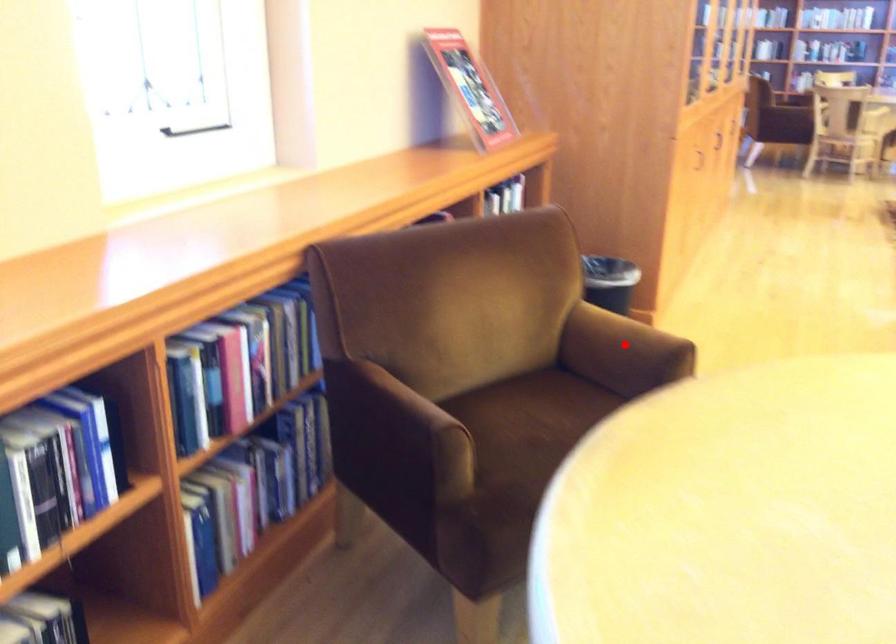
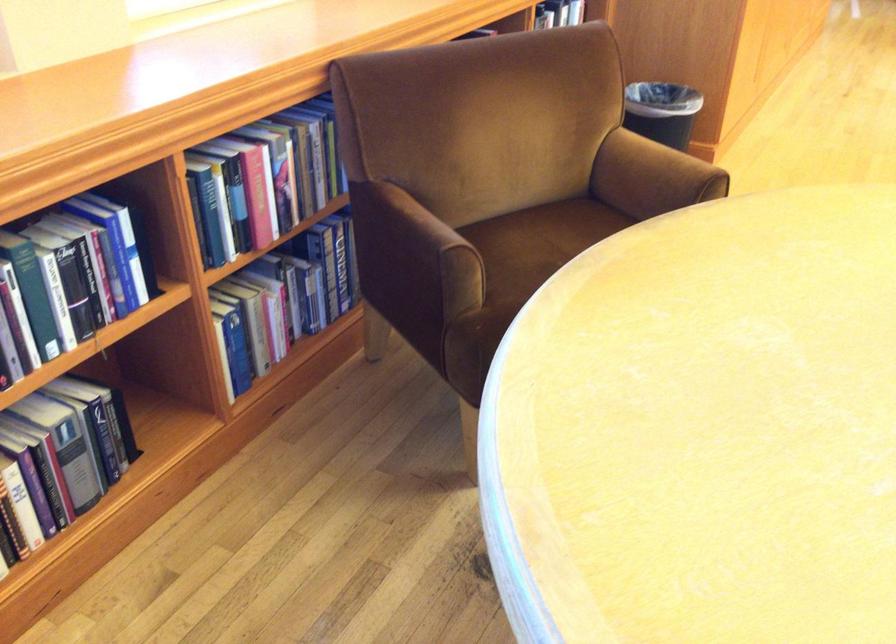
The point at the highlighted location is marked in the first image. Where is the corresponding point in the second image?

(655, 171)